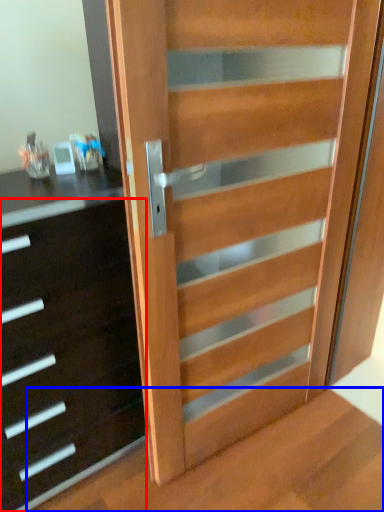
Question: Which point is closer to the camera, chest of drawers (highlighted by a red box) or stairwell (highlighted by a blue box)?

Choices:
 (A) chest of drawers
 (B) stairwell

Answer: (B)